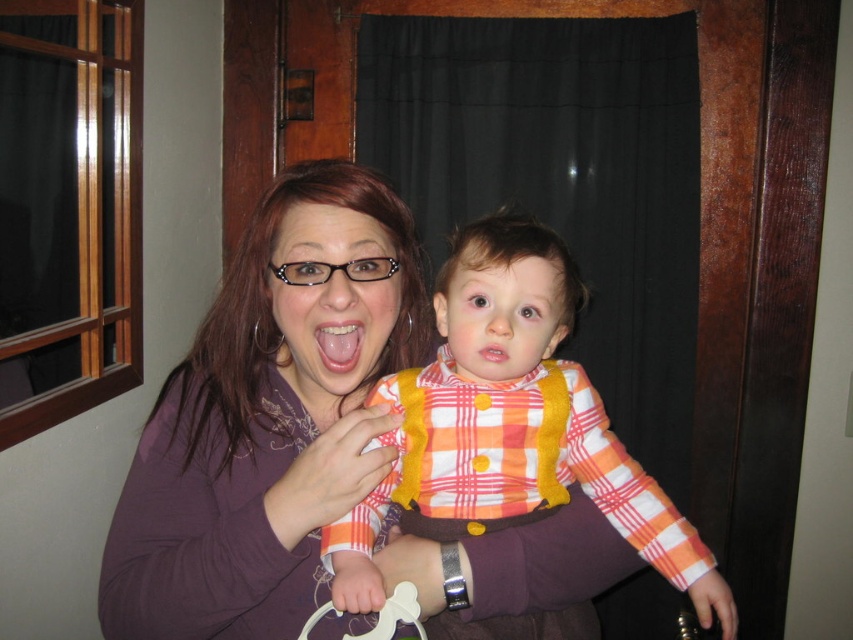
Question: Can you confirm if matte purple shirt at center is positioned below plaid fabric shirt at center?

Choices:
 (A) no
 (B) yes

Answer: (A)

Question: Can you confirm if matte purple shirt at center is positioned to the left of pink glossy tongue at center?

Choices:
 (A) yes
 (B) no

Answer: (A)

Question: Which is farther from the matte purple shirt at center?

Choices:
 (A) pink glossy tongue at center
 (B) plaid fabric shirt at center

Answer: (A)

Question: Among these points, which one is nearest to the camera?

Choices:
 (A) [428, 531]
 (B) [338, 349]

Answer: (B)

Question: Can you confirm if plaid fabric shirt at center is smaller than pink glossy tongue at center?

Choices:
 (A) no
 (B) yes

Answer: (A)

Question: Which point is closer to the camera?

Choices:
 (A) pink glossy tongue at center
 (B) plaid fabric shirt at center

Answer: (B)